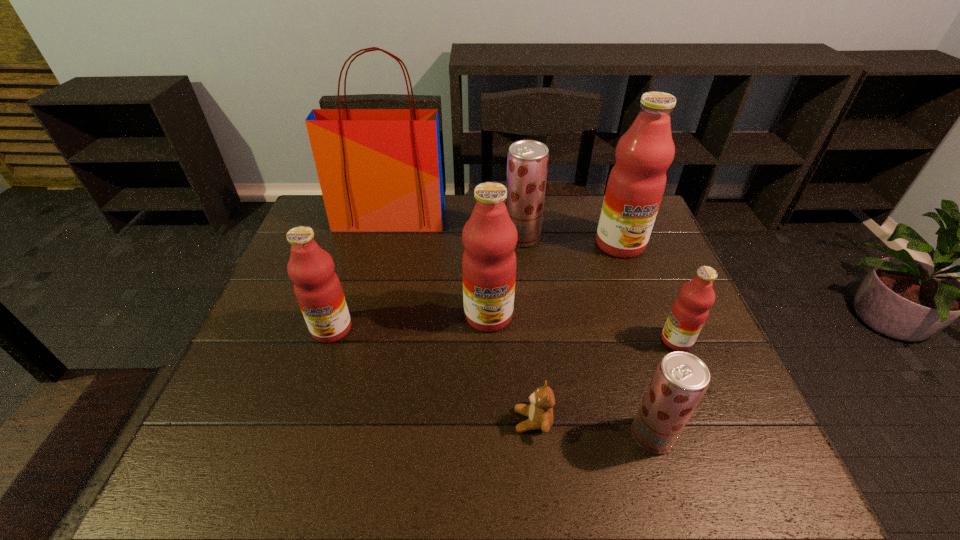
Find the location of `vacant space that's between the leftmost pink fruit juice and the bigger strawberry fruit juice`. vacant space that's between the leftmost pink fruit juice and the bigger strawberry fruit juice is located at coordinates (427, 283).

This screenshot has height=540, width=960. Identify the location of empty location between the smallest pink fruit juice and the shopping bag. (533, 280).

Where is `free space between the shortest object and the fifth shortest fruit juice`? The height and width of the screenshot is (540, 960). free space between the shortest object and the fifth shortest fruit juice is located at coordinates (511, 368).

At what (x,y) coordinates should I click in order to perform the action: click on unoccupied position between the tallest fruit juice and the nearer strawberry fruit juice. Please return your answer as a coordinate pair (x, y). The height and width of the screenshot is (540, 960). Looking at the image, I should click on (636, 340).

Locate an element on the screen. object that is the closest to the fifth shortest fruit juice is located at coordinates (540, 415).

Locate an element on the screen. This screenshot has width=960, height=540. object that ranks as the fifth closest to the right strawberry fruit juice is located at coordinates (527, 162).

The image size is (960, 540). I want to click on fruit juice that is the fifth closest to the blue shopping bag, so click(x=690, y=310).

Identify which fruit juice is the third nearest to the third tallest object. Please provide its 2D coordinates. Your answer should be formatted as a tuple, i.e. [(x, y)], where the tuple contains the x and y coordinates of a point satisfying the conditions above.

[(636, 184)]

Locate which pink fruit juice ranks third in proximity to the shopping bag. Please provide its 2D coordinates. Your answer should be formatted as a tuple, i.e. [(x, y)], where the tuple contains the x and y coordinates of a point satisfying the conditions above.

[(636, 184)]

Where is `pink fruit juice that is the second closest to the third tallest object`? This screenshot has height=540, width=960. pink fruit juice that is the second closest to the third tallest object is located at coordinates (636, 184).